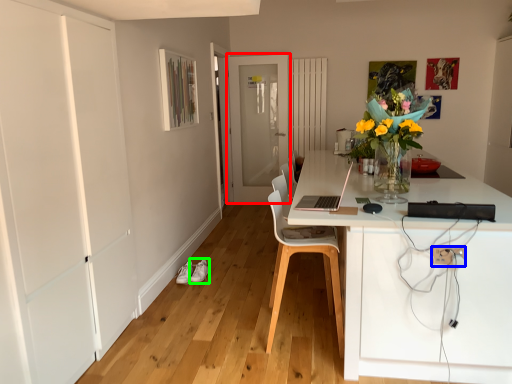
Question: Which is nearer to the door (highlighted by a red box)? electric outlet (highlighted by a blue box) or shoe (highlighted by a green box).

Choices:
 (A) electric outlet
 (B) shoe

Answer: (B)